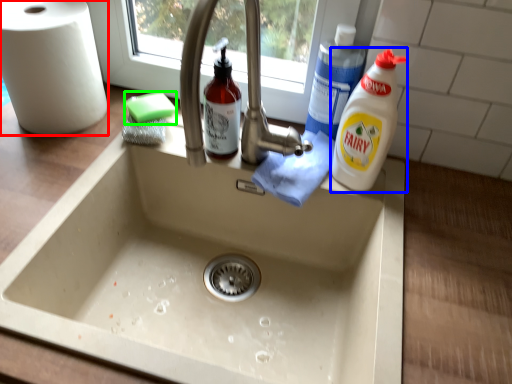
Question: Estimate the real-world distances between objects in this image. Which object is farther from paper towel (highlighted by a red box), cleaning product (highlighted by a blue box) or soap (highlighted by a green box)?

Choices:
 (A) cleaning product
 (B) soap

Answer: (A)